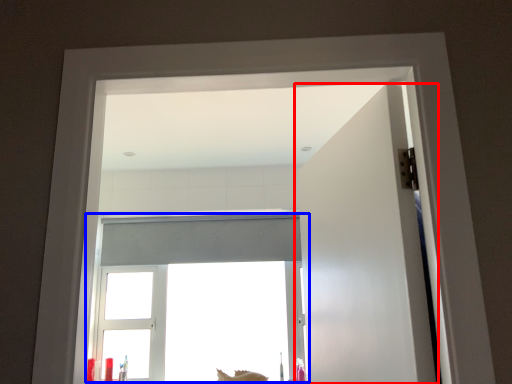
Question: Which object is closer to the camera taking this photo, door (highlighted by a red box) or window (highlighted by a blue box)?

Choices:
 (A) door
 (B) window

Answer: (A)